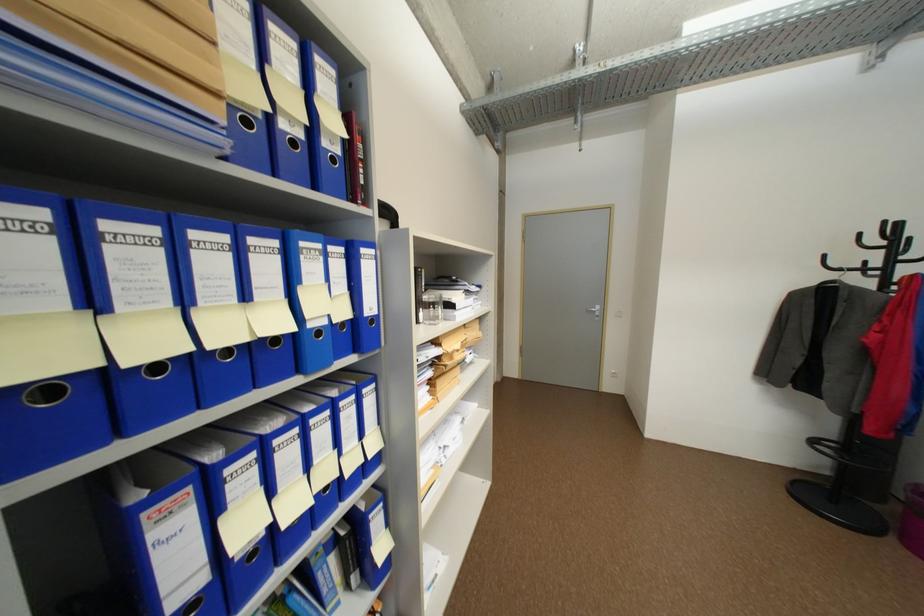
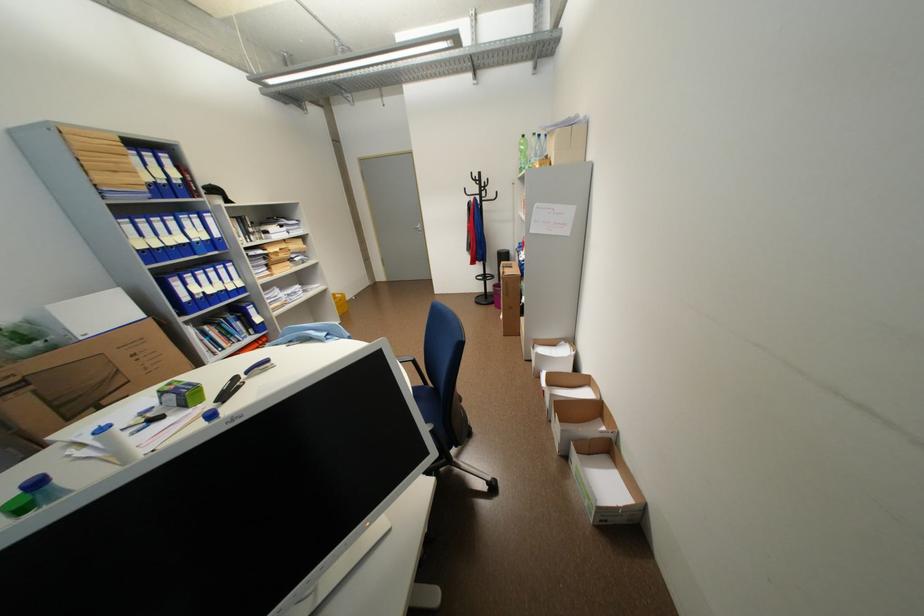
In a continuous first-person perspective shot, in which direction is the camera moving?

The cameraman walked toward right, backward.